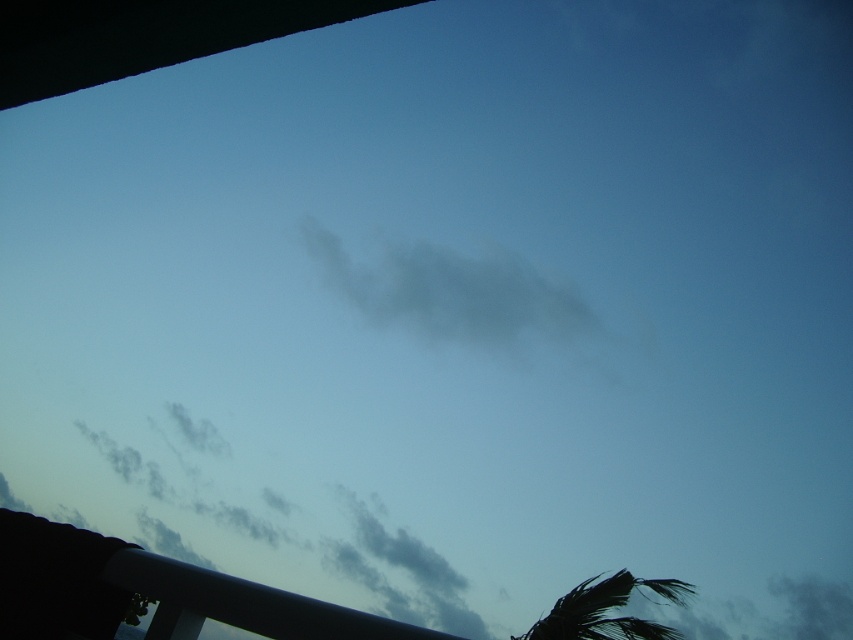
Question: Which point appears farthest from the camera in this image?

Choices:
 (A) (590, 605)
 (B) (538, 294)

Answer: (B)

Question: Is gray/cloudy cloud at center positioned at the back of green leafy palm tree at lower right?

Choices:
 (A) no
 (B) yes

Answer: (B)

Question: From the image, what is the correct spatial relationship of gray/cloudy cloud at center in relation to green leafy palm tree at lower right?

Choices:
 (A) left
 (B) right

Answer: (A)

Question: Which point is farther from the camera taking this photo?

Choices:
 (A) (576, 628)
 (B) (355, 300)

Answer: (B)

Question: Is gray/cloudy cloud at center wider than green leafy palm tree at lower right?

Choices:
 (A) yes
 (B) no

Answer: (A)